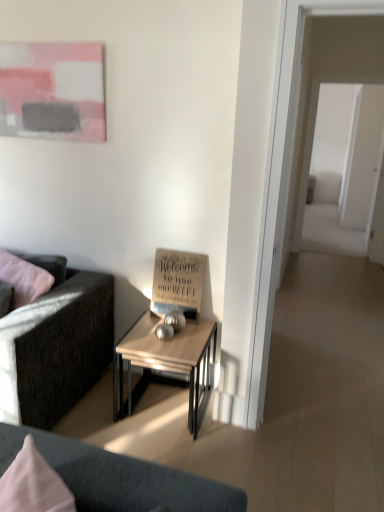
Question: Considering the positions of point (160, 364) and point (43, 264), is point (160, 364) closer or farther from the camera than point (43, 264)?

Choices:
 (A) farther
 (B) closer

Answer: (B)

Question: In terms of height, does wooden table at center look taller or shorter compared to dark gray fabric couch at left?

Choices:
 (A) short
 (B) tall

Answer: (A)

Question: Which of these objects is positioned closest to the wooden sign at center?

Choices:
 (A) dark gray fabric couch at left
 (B) transparent glass door at right
 (C) matte pink painting at upper left
 (D) wooden table at center

Answer: (D)

Question: Estimate the real-world distances between objects in this image. Which object is closer to the transparent glass door at right?

Choices:
 (A) wooden sign at center
 (B) dark gray fabric couch at left
 (C) matte pink painting at upper left
 (D) wooden table at center

Answer: (A)